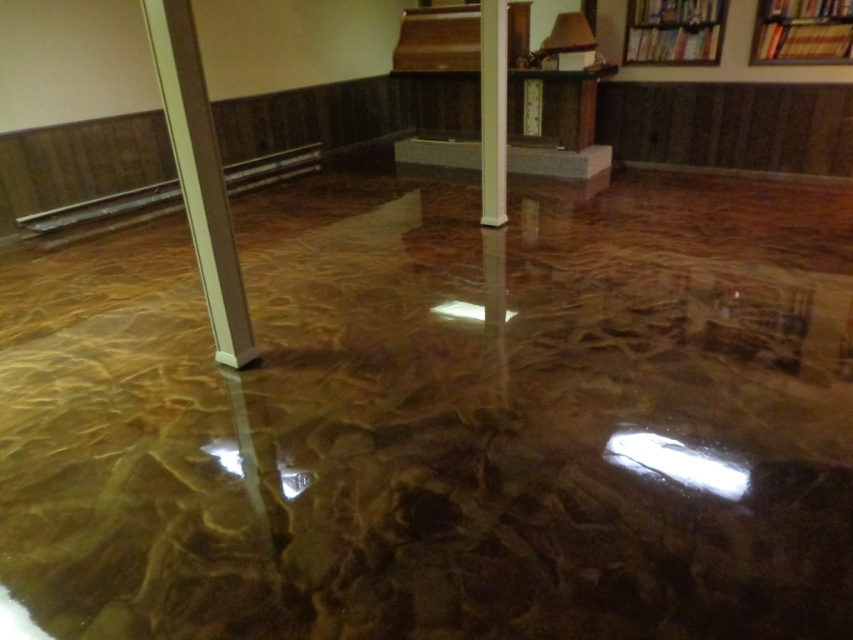
Is metallic polished pillar at left to the right of brown wooden bookshelf at upper right from the viewer's perspective?

In fact, metallic polished pillar at left is to the left of brown wooden bookshelf at upper right.

Does metallic polished pillar at left have a smaller size compared to brown wooden bookshelf at upper right?

No.

Is point (169, 54) positioned in front of point (670, 42)?

Yes, it is in front of point (670, 42).

At what (x,y) coordinates should I click in order to perform the action: click on metallic polished pillar at left. Please return your answer as a coordinate pair (x, y). This screenshot has width=853, height=640. Looking at the image, I should click on (199, 176).

Consider the image. Can you confirm if wooden bookshelf at upper right is positioned to the left of white glossy pillar at center?

In fact, wooden bookshelf at upper right is to the right of white glossy pillar at center.

The image size is (853, 640). What are the coordinates of `wooden bookshelf at upper right` in the screenshot? It's located at (802, 32).

Find the location of a particular element. This screenshot has height=640, width=853. brown wooden bookshelf at upper right is located at coordinates 672,29.

Is point (630, 33) less distant than point (483, 156)?

No.

This screenshot has width=853, height=640. Find the location of `brown wooden bookshelf at upper right`. brown wooden bookshelf at upper right is located at coordinates (672, 29).